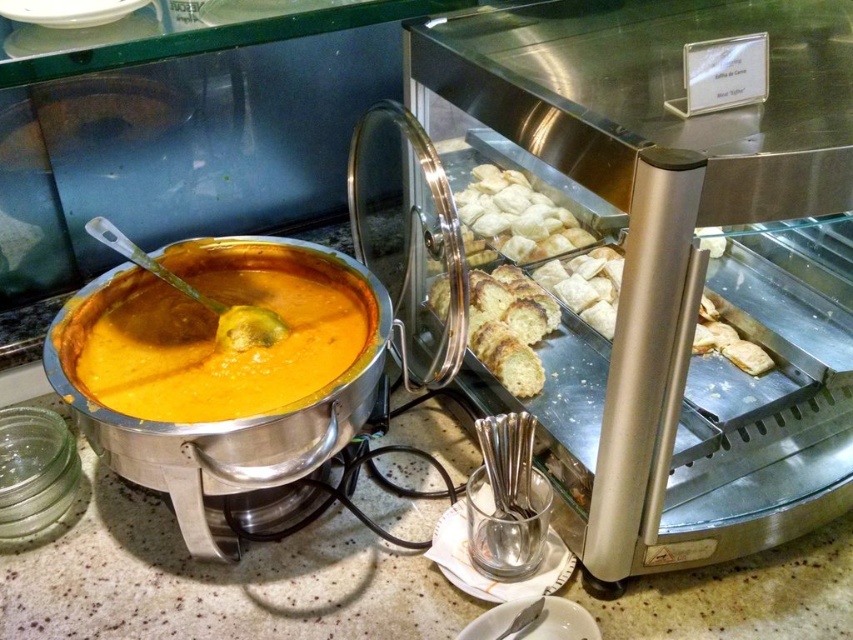
Question: Can you confirm if orange matte soup at center is positioned below golden brown crumbly bread at center?

Choices:
 (A) no
 (B) yes

Answer: (B)

Question: Does golden brown pastry at center lie in front of golden brown crumbly pastry at center?

Choices:
 (A) yes
 (B) no

Answer: (B)

Question: Which of these objects is positioned closest to the golden brown crumbly bread at center?

Choices:
 (A) golden brown pastry at center
 (B) golden brown crumbly pastry at center

Answer: (B)

Question: Observing the image, what is the correct spatial positioning of orange matte soup at center in reference to golden brown crumbly pastry at center?

Choices:
 (A) left
 (B) right

Answer: (A)

Question: Based on their relative distances, which object is farther from the orange matte soup at center?

Choices:
 (A) golden brown crumbly bread at center
 (B) golden brown crumbly pastry at center
 (C) golden brown pastry at center

Answer: (B)

Question: Which point appears farthest from the camera in this image?

Choices:
 (A) (299, 298)
 (B) (547, 266)
 (C) (469, 289)

Answer: (B)